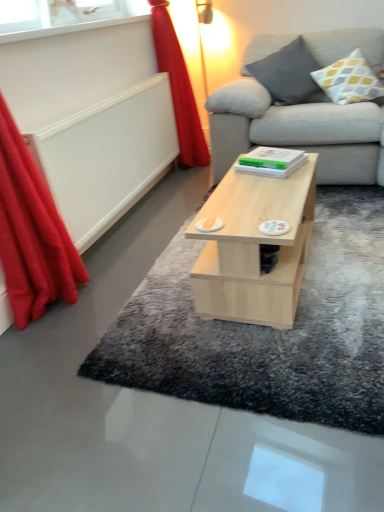
You are a GUI agent. You are given a task and a screenshot of the screen. Output one action in this format:
    pyautogui.click(x=<x>, y=<y>)
    Task: Click on the free spot below red fabric curtain at left, which ranks as the second curtain in back-to-front order (from a real-world perspective)
    Image resolution: width=384 pixels, height=512 pixels.
    Given the screenshot: What is the action you would take?
    pyautogui.click(x=75, y=293)